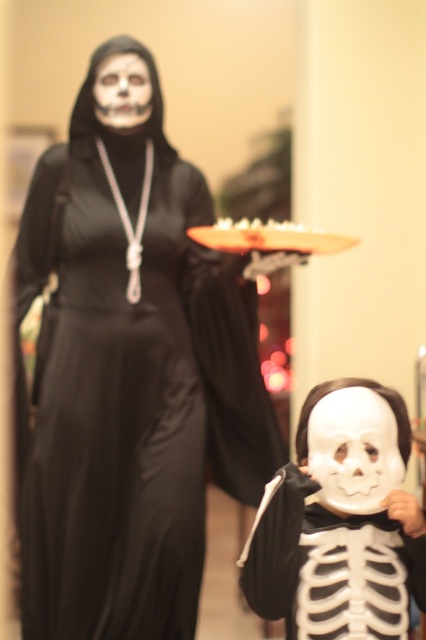
Question: Is black satin dress at upper left thinner than white matte mask at lower center?

Choices:
 (A) yes
 (B) no

Answer: (B)

Question: Does black satin dress at upper left appear on the left side of white matte mask at lower center?

Choices:
 (A) no
 (B) yes

Answer: (B)

Question: Among these objects, which one is farthest from the camera?

Choices:
 (A) black satin dress at upper left
 (B) white matte mask at lower center

Answer: (A)

Question: Which of the following is the closest to the observer?

Choices:
 (A) (313, 528)
 (B) (138, 576)

Answer: (A)

Question: Is black satin dress at upper left behind white matte mask at lower center?

Choices:
 (A) yes
 (B) no

Answer: (A)